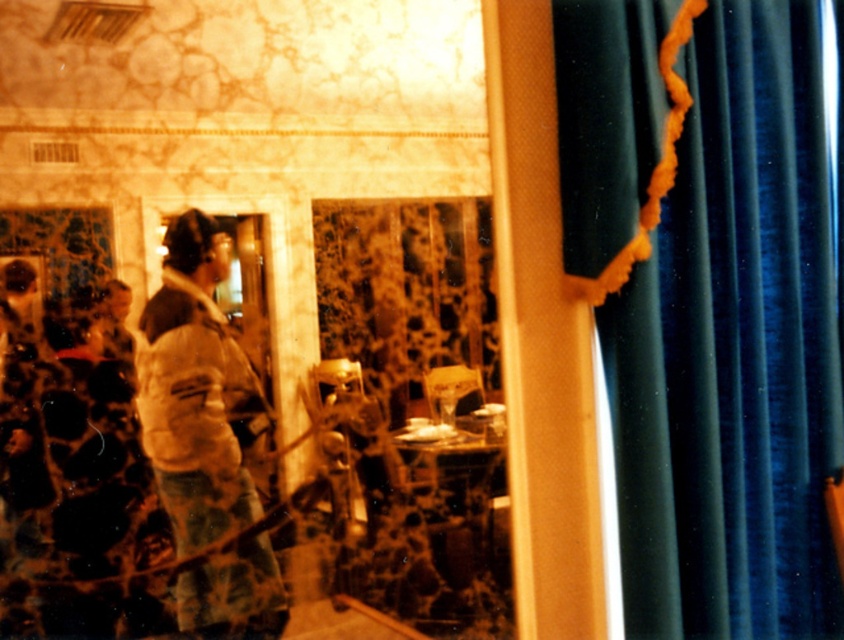
Which of these two, velvet blue curtain at right or white fuzzy jacket at left, stands shorter?

white fuzzy jacket at left

Who is taller, velvet blue curtain at right or white fuzzy jacket at left?

velvet blue curtain at right is taller.

Locate an element on the screen. The image size is (844, 640). velvet blue curtain at right is located at coordinates (710, 308).